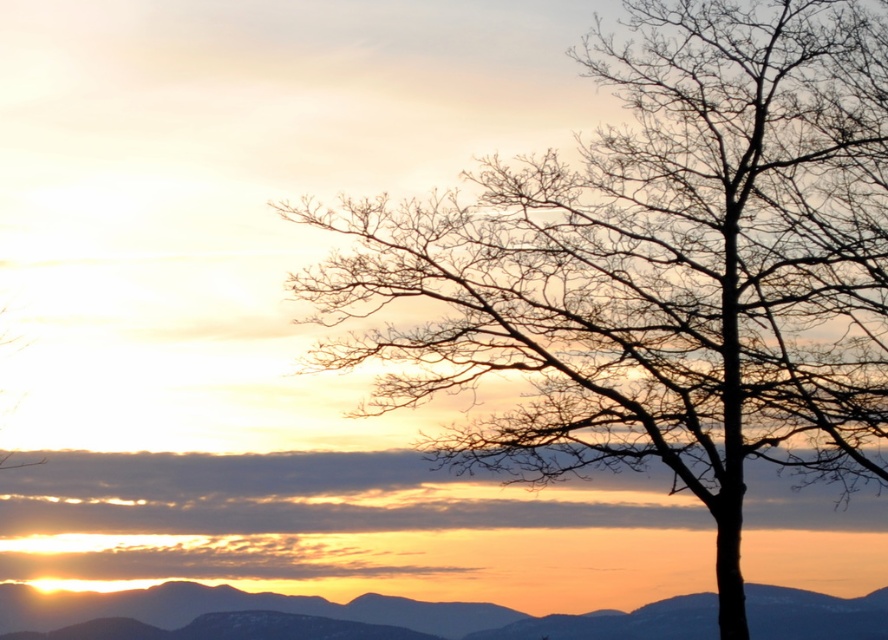
You are an artist sketching this sunset scene. You want to ensure the silhouette bark tree at right and the silvery metallic mountain at lower left are positioned correctly relative to each other. According to the scene, which object is located to the right of the other?

The silhouette bark tree at right is to the right of the silvery metallic mountain at lower left.